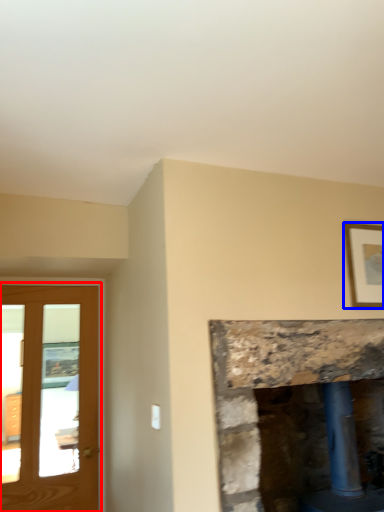
Question: Which of the following is the farthest to the observer, screen door (highlighted by a red box) or picture frame (highlighted by a blue box)?

Choices:
 (A) screen door
 (B) picture frame

Answer: (A)